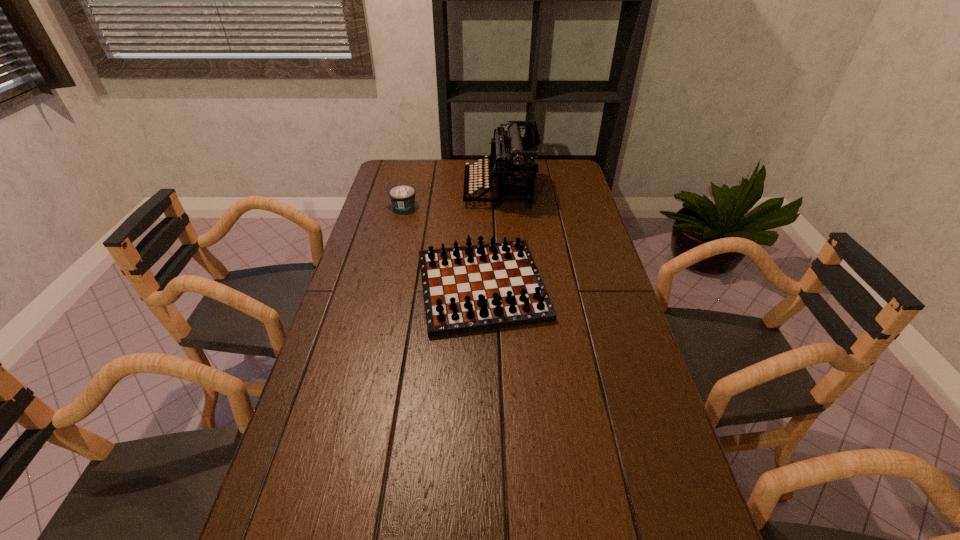
Where is `object that is at the far edge`? object that is at the far edge is located at coordinates (512, 162).

This screenshot has width=960, height=540. I want to click on object that is at the left edge, so click(x=402, y=197).

The image size is (960, 540). Identify the location of blank space at the far edge of the desktop. (446, 178).

In the image, there is a desktop. At what (x,y) coordinates should I click in order to perform the action: click on vacant space at the left edge. Please return your answer as a coordinate pair (x, y). This screenshot has height=540, width=960. Looking at the image, I should click on (343, 365).

Find the location of a particular element. free region at the right edge is located at coordinates point(605,246).

You are a GUI agent. You are given a task and a screenshot of the screen. Output one action in this format:
    pyautogui.click(x=<x>, y=<y>)
    Task: Click on the free point between the typewriter and the yogurt
    The width and height of the screenshot is (960, 540).
    Given the screenshot: What is the action you would take?
    pyautogui.click(x=450, y=198)

Identify the location of free space between the second shortest object and the leftmost object. (442, 246).

Where is `vacant area between the leftmost object and the second tallest object`? vacant area between the leftmost object and the second tallest object is located at coordinates (442, 246).

Where is `free point between the second shortest object and the leftmost object`? free point between the second shortest object and the leftmost object is located at coordinates (442, 246).

Find the location of a particular element. vacant space that's between the typewriter and the yogurt is located at coordinates (450, 198).